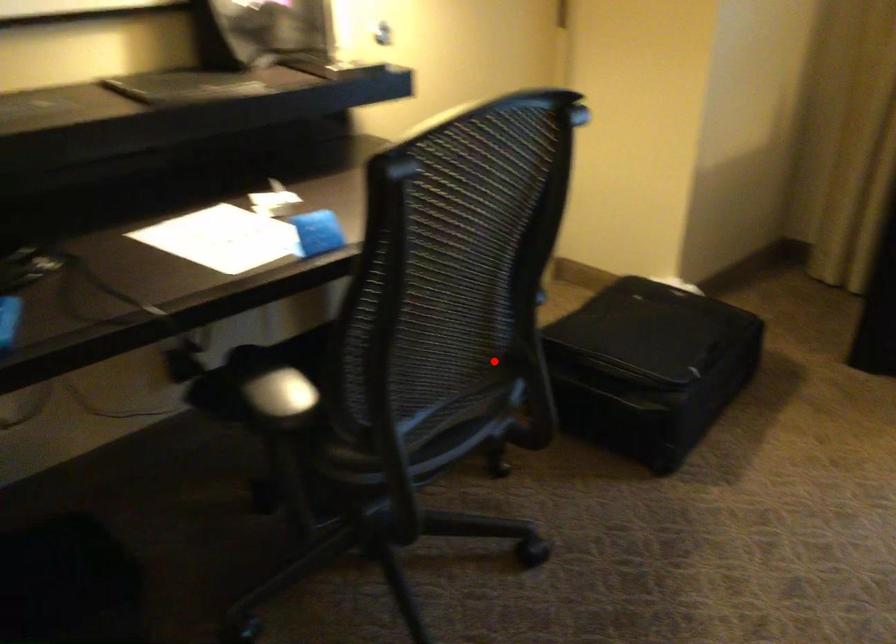
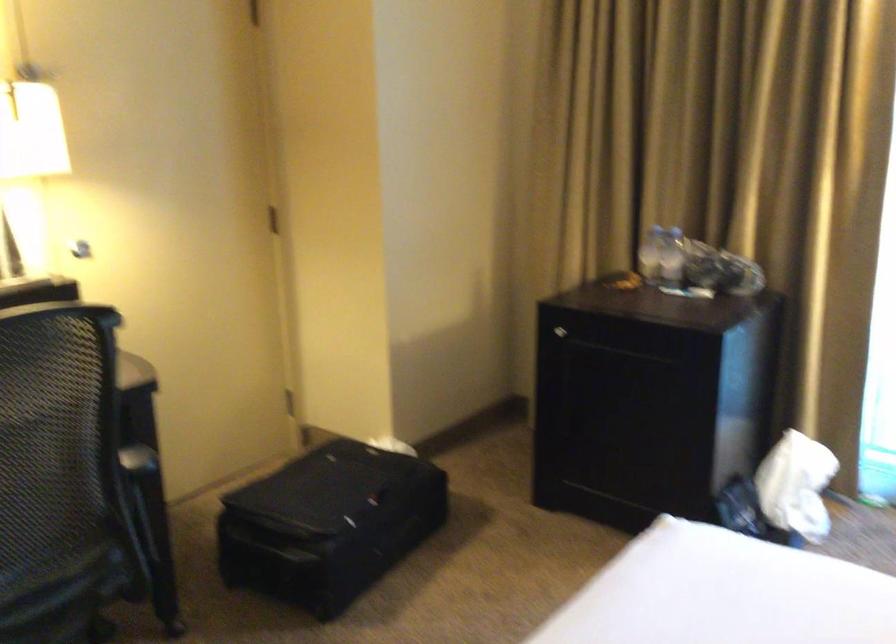
Locate, in the second image, the point that corresponds to the highlighted location in the first image.

(136, 527)